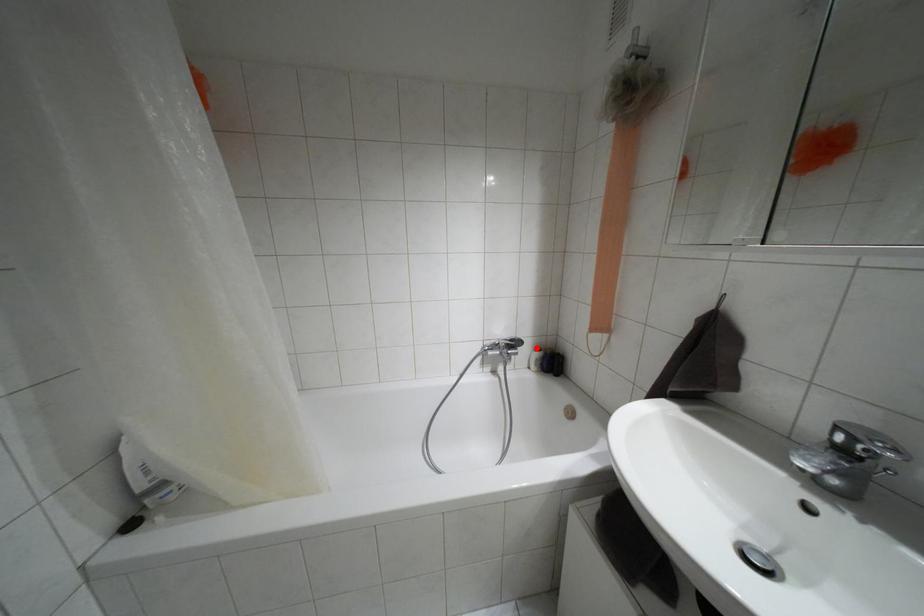
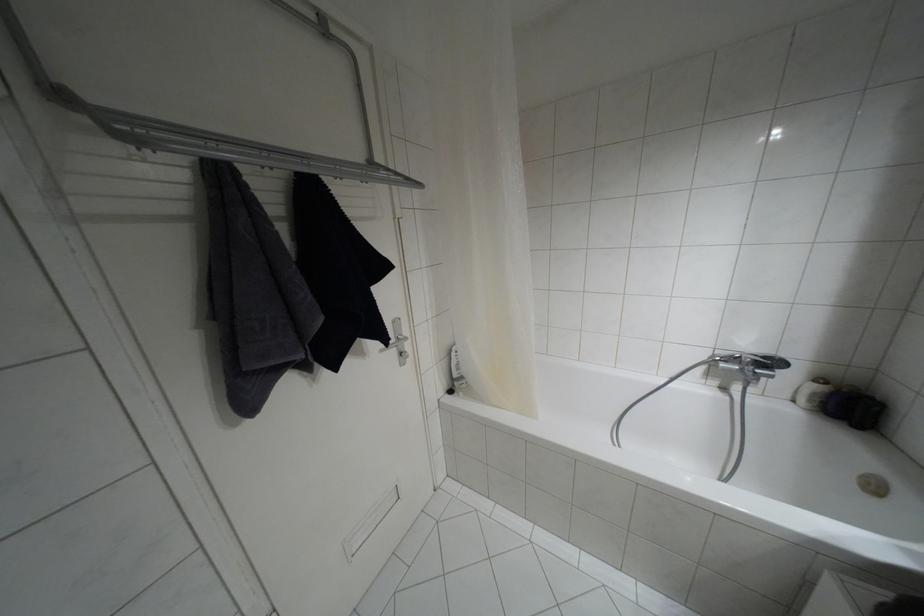
Question: A red point is marked in image1. In image2, is the corresponding 3D point closer to the camera or farther? Reply with the corresponding letter.

Choices:
 (A) The corresponding 3D point is closer.
 (B) The corresponding 3D point is farther.

Answer: (A)